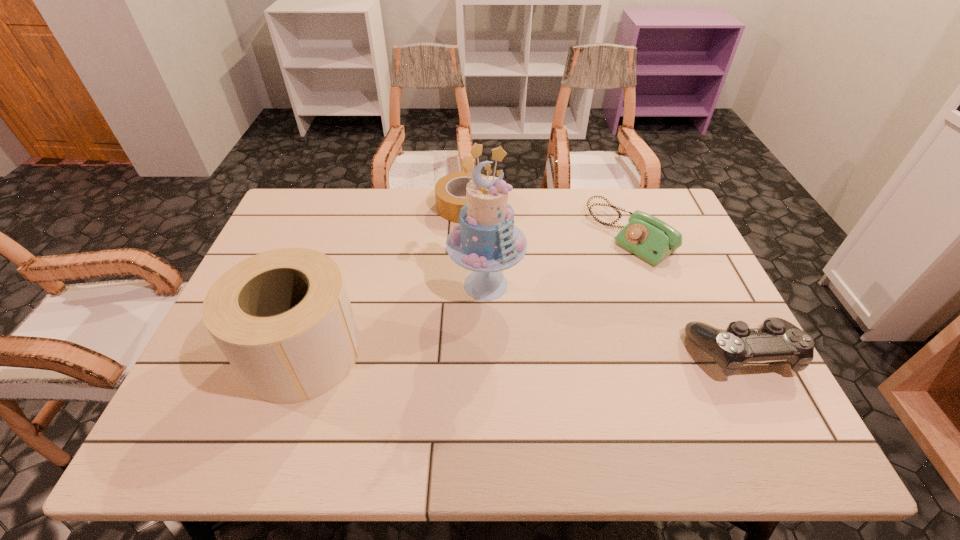
Identify the location of free space located 0.170m with a ladder on the side of the tallest object. (501, 368).

The image size is (960, 540). In order to click on vacant space situated 0.330m on the dial of the telephone in this screenshot , I will do `click(527, 312)`.

The width and height of the screenshot is (960, 540). Find the location of `free space located on the dial of the telephone`. free space located on the dial of the telephone is located at coordinates (543, 300).

At what (x,y) coordinates should I click in order to perform the action: click on free location located on the dial of the telephone. Please return your answer as a coordinate pair (x, y). Image resolution: width=960 pixels, height=540 pixels. Looking at the image, I should click on (559, 290).

Where is `free spot located at the edge of the shortest object`? free spot located at the edge of the shortest object is located at coordinates (475, 310).

Where is `free space located 0.390m at the edge of the shortest object`? The width and height of the screenshot is (960, 540). free space located 0.390m at the edge of the shortest object is located at coordinates (476, 322).

Where is `blank space located at the edge of the shortest object`? blank space located at the edge of the shortest object is located at coordinates [x=475, y=314].

The image size is (960, 540). I want to click on telephone that is at the far edge, so click(x=648, y=237).

Find the location of a particular element. The width and height of the screenshot is (960, 540). duct tape positioned at the far edge is located at coordinates (448, 189).

At what (x,y) coordinates should I click in order to perform the action: click on toilet tissue that is at the near edge. Please return your answer as a coordinate pair (x, y). Looking at the image, I should click on (283, 319).